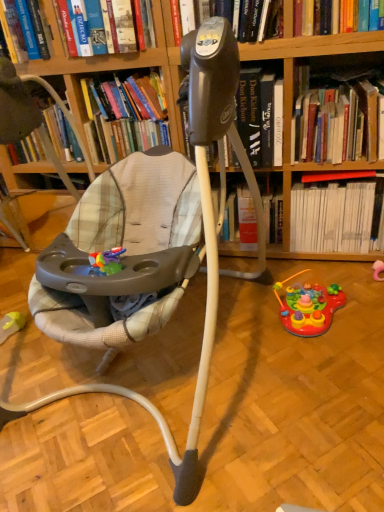
Where is `vacant area situated to the left side of rubberized plastic activity center at lower right, the 2th toy positioned from the left`? The height and width of the screenshot is (512, 384). vacant area situated to the left side of rubberized plastic activity center at lower right, the 2th toy positioned from the left is located at coordinates (248, 327).